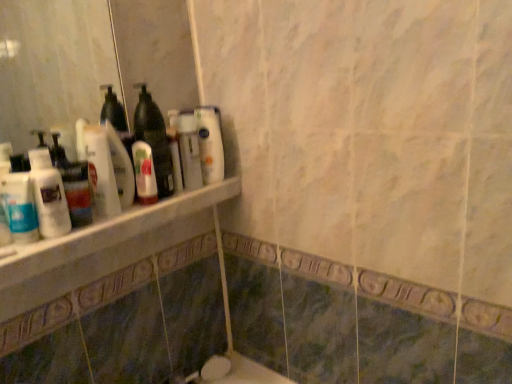
Locate an element on the screen. The width and height of the screenshot is (512, 384). vacant area that is in front of translucent plastic mouthwash at shelf center, which appears as the second mouthwash when viewed from the left is located at coordinates (116, 218).